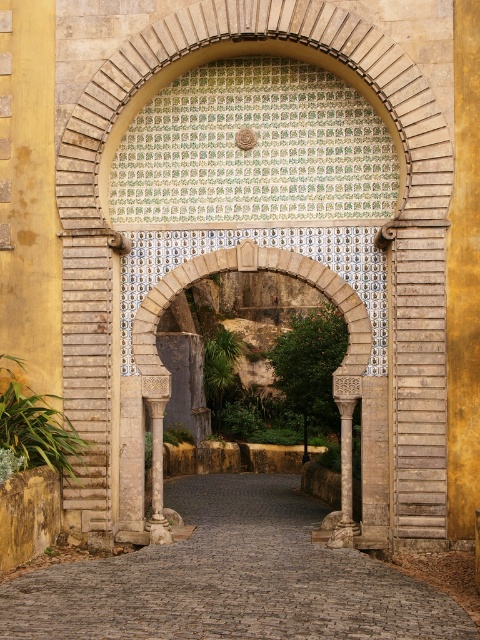
Question: Is stone archway at center to the right of marble column at center from the viewer's perspective?

Choices:
 (A) yes
 (B) no

Answer: (B)

Question: Is brown cobblestone path at center further to camera compared to white stone column at center?

Choices:
 (A) yes
 (B) no

Answer: (B)

Question: Which is farther from the white stone column at center?

Choices:
 (A) marble column at center
 (B) stone archway at center

Answer: (A)

Question: Is brown cobblestone path at center behind marble column at center?

Choices:
 (A) yes
 (B) no

Answer: (B)

Question: Which object appears closest to the camera in this image?

Choices:
 (A) white stone column at center
 (B) stone archway at center
 (C) brown cobblestone path at center
 (D) marble column at center

Answer: (C)

Question: Estimate the real-world distances between objects in this image. Which object is farther from the white stone column at center?

Choices:
 (A) stone archway at center
 (B) brown cobblestone path at center
 (C) marble column at center

Answer: (C)